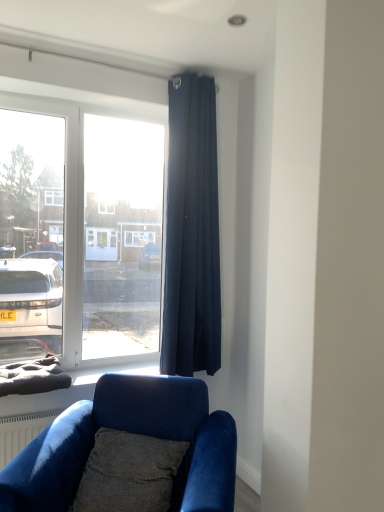
Question: Is velvet blue couch at lower left aimed at textured gray pillow at lower center?

Choices:
 (A) yes
 (B) no

Answer: (A)

Question: Considering the relative sizes of velvet blue couch at lower left and textured gray pillow at lower center in the image provided, is velvet blue couch at lower left smaller than textured gray pillow at lower center?

Choices:
 (A) yes
 (B) no

Answer: (B)

Question: Considering the relative sizes of velvet blue couch at lower left and textured gray pillow at lower center in the image provided, is velvet blue couch at lower left shorter than textured gray pillow at lower center?

Choices:
 (A) no
 (B) yes

Answer: (A)

Question: Considering the relative positions of velvet blue couch at lower left and textured gray pillow at lower center in the image provided, is velvet blue couch at lower left to the left of textured gray pillow at lower center from the viewer's perspective?

Choices:
 (A) yes
 (B) no

Answer: (A)

Question: Is velvet blue couch at lower left positioned behind textured gray pillow at lower center?

Choices:
 (A) yes
 (B) no

Answer: (B)

Question: Does velvet blue couch at lower left have a lesser width compared to textured gray pillow at lower center?

Choices:
 (A) no
 (B) yes

Answer: (A)

Question: Can you confirm if velvet blue couch at lower left is taller than dark blue fabric curtain at upper right?

Choices:
 (A) no
 (B) yes

Answer: (A)

Question: Is the surface of velvet blue couch at lower left in direct contact with dark blue fabric curtain at upper right?

Choices:
 (A) yes
 (B) no

Answer: (B)

Question: Is velvet blue couch at lower left not within dark blue fabric curtain at upper right?

Choices:
 (A) yes
 (B) no

Answer: (A)

Question: Considering the relative positions of velvet blue couch at lower left and dark blue fabric curtain at upper right in the image provided, is velvet blue couch at lower left to the left of dark blue fabric curtain at upper right from the viewer's perspective?

Choices:
 (A) yes
 (B) no

Answer: (A)

Question: Is velvet blue couch at lower left closer to camera compared to dark blue fabric curtain at upper right?

Choices:
 (A) yes
 (B) no

Answer: (A)

Question: Is velvet blue couch at lower left far away from dark blue fabric curtain at upper right?

Choices:
 (A) yes
 (B) no

Answer: (B)

Question: Is textured gray pillow at lower center positioned far away from velvet blue couch at lower left?

Choices:
 (A) yes
 (B) no

Answer: (B)